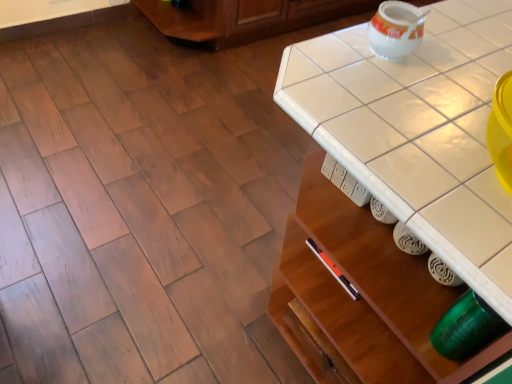
Question: Is white tile counter top at center surrounded by white glossy tea pot at upper right?

Choices:
 (A) no
 (B) yes

Answer: (A)

Question: Does white glossy tea pot at upper right have a lesser width compared to white tile counter top at center?

Choices:
 (A) yes
 (B) no

Answer: (A)

Question: Can you confirm if white glossy tea pot at upper right is bigger than white tile counter top at center?

Choices:
 (A) no
 (B) yes

Answer: (A)

Question: From a real-world perspective, is white glossy tea pot at upper right under white tile counter top at center?

Choices:
 (A) no
 (B) yes

Answer: (A)

Question: Is white glossy tea pot at upper right not near white tile counter top at center?

Choices:
 (A) yes
 (B) no

Answer: (B)

Question: Is white glossy tea pot at upper right in contact with white tile counter top at center?

Choices:
 (A) yes
 (B) no

Answer: (B)

Question: Does white tile counter top at center have a greater height compared to white glossy tea pot at upper right?

Choices:
 (A) yes
 (B) no

Answer: (B)

Question: Is white tile counter top at center positioned with its back to white glossy tea pot at upper right?

Choices:
 (A) no
 (B) yes

Answer: (A)

Question: From the image's perspective, is white tile counter top at center beneath white glossy tea pot at upper right?

Choices:
 (A) no
 (B) yes

Answer: (B)

Question: Is white tile counter top at center facing towards white glossy tea pot at upper right?

Choices:
 (A) yes
 (B) no

Answer: (B)

Question: Is white tile counter top at center closer to camera compared to white glossy tea pot at upper right?

Choices:
 (A) no
 (B) yes

Answer: (B)

Question: Are white tile counter top at center and white glossy tea pot at upper right making contact?

Choices:
 (A) no
 (B) yes

Answer: (A)

Question: Is white glossy tea pot at upper right in front of or behind white tile counter top at center in the image?

Choices:
 (A) behind
 (B) front

Answer: (A)